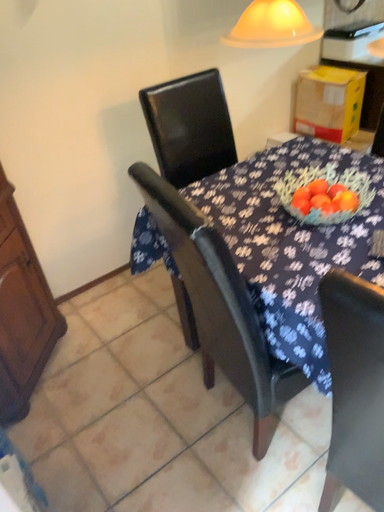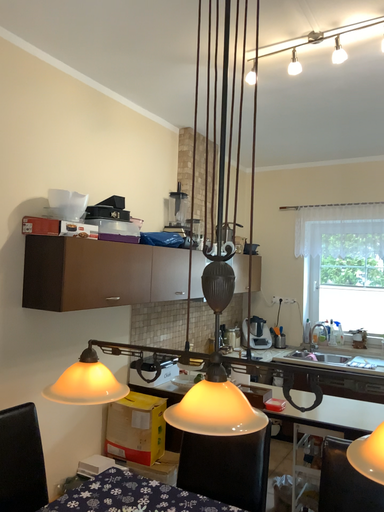
Question: Which way did the camera rotate in the video?

Choices:
 (A) rotated left
 (B) rotated right

Answer: (B)